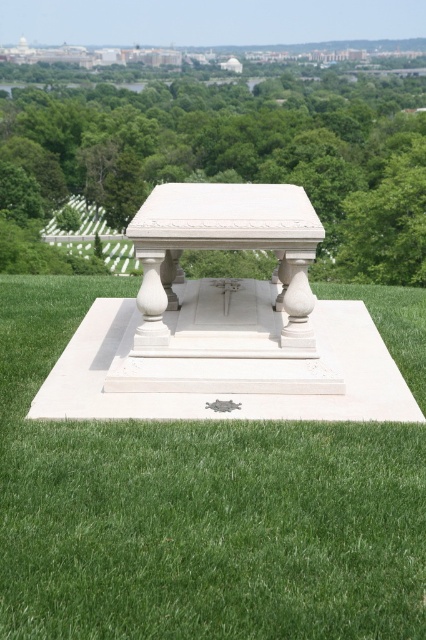
Question: Is green grass at center in front of white marble table at center?

Choices:
 (A) yes
 (B) no

Answer: (A)

Question: Can you confirm if green grass at center is thinner than green leafy tree at center?

Choices:
 (A) no
 (B) yes

Answer: (B)

Question: Which point appears closest to the camera in this image?

Choices:
 (A) (307, 483)
 (B) (31, 141)

Answer: (A)

Question: Which object is positioned closest to the green leafy tree at center?

Choices:
 (A) green grass at center
 (B) white marble table at center

Answer: (B)

Question: Which of the following is the closest to the observer?

Choices:
 (A) white marble table at center
 (B) green leafy tree at center
 (C) green grass at center

Answer: (C)

Question: Is green grass at center positioned before green leafy tree at center?

Choices:
 (A) no
 (B) yes

Answer: (B)